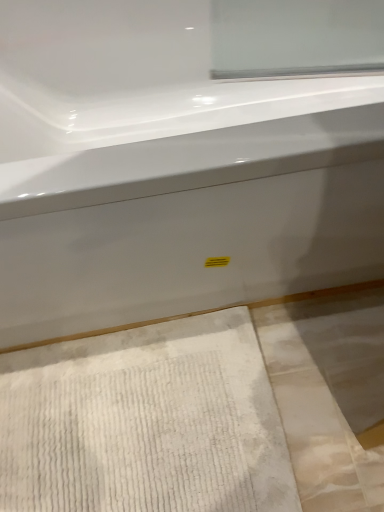
Question: Does white textured bath mat at lower left appear on the right side of white glossy bathtub at center?

Choices:
 (A) no
 (B) yes

Answer: (A)

Question: Is white textured bath mat at lower left oriented towards white glossy bathtub at center?

Choices:
 (A) yes
 (B) no

Answer: (B)

Question: Is white textured bath mat at lower left at the left side of white glossy bathtub at center?

Choices:
 (A) no
 (B) yes

Answer: (B)

Question: Is white textured bath mat at lower left positioned with its back to white glossy bathtub at center?

Choices:
 (A) yes
 (B) no

Answer: (A)

Question: Is white textured bath mat at lower left positioned beyond the bounds of white glossy bathtub at center?

Choices:
 (A) no
 (B) yes

Answer: (B)

Question: Considering the relative sizes of white textured bath mat at lower left and white glossy bathtub at center in the image provided, is white textured bath mat at lower left thinner than white glossy bathtub at center?

Choices:
 (A) yes
 (B) no

Answer: (A)

Question: Considering the relative sizes of white glossy bathtub at center and white textured bath mat at lower left in the image provided, is white glossy bathtub at center smaller than white textured bath mat at lower left?

Choices:
 (A) no
 (B) yes

Answer: (A)

Question: Does white glossy bathtub at center lie behind white textured bath mat at lower left?

Choices:
 (A) yes
 (B) no

Answer: (B)

Question: Is white glossy bathtub at center oriented away from white textured bath mat at lower left?

Choices:
 (A) yes
 (B) no

Answer: (B)

Question: Considering the relative positions of white glossy bathtub at center and white textured bath mat at lower left in the image provided, is white glossy bathtub at center to the right of white textured bath mat at lower left from the viewer's perspective?

Choices:
 (A) no
 (B) yes

Answer: (B)

Question: Is white textured bath mat at lower left a part of white glossy bathtub at center?

Choices:
 (A) yes
 (B) no

Answer: (B)

Question: From the image's perspective, is white glossy bathtub at center located beneath white textured bath mat at lower left?

Choices:
 (A) no
 (B) yes

Answer: (A)

Question: Is point (216, 419) closer or farther from the camera than point (41, 161)?

Choices:
 (A) closer
 (B) farther

Answer: (B)